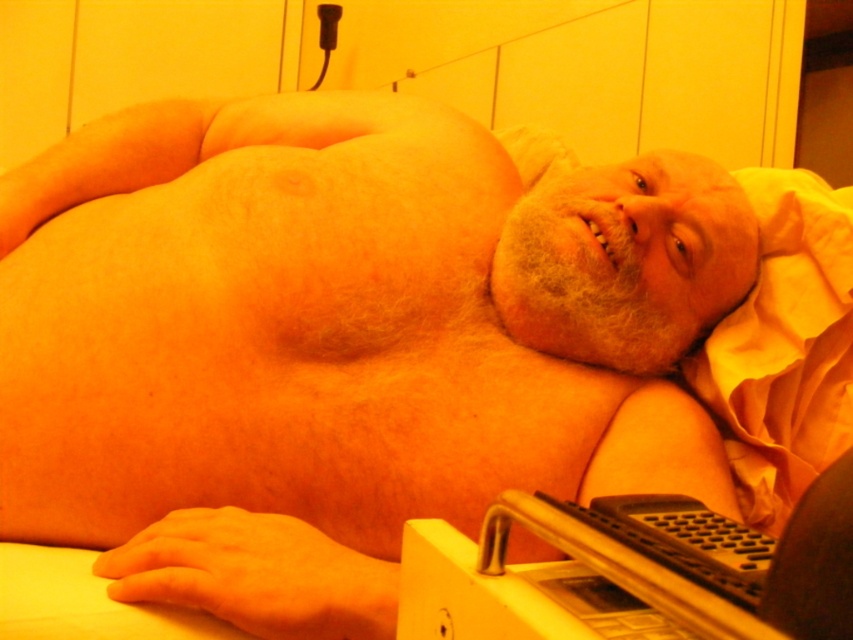
You are a technician in a medical facility. You need to place a 12 inch long medical tool on the nearest flat surface. The black plastic laptop at lower right is present. Can you place the tool on it?

The black plastic laptop at lower right is 11.51 inches from the viewer, which is shorter than the 12 inch medical tool. Therefore, the tool cannot be placed on the black plastic laptop at lower right as it may not fit properly.

Based on the photo, you are a nurse in the room and need to retrieve both the black plastic laptop at lower right and the yellow fabric pillow at right. Which object should you reach for first to minimize the distance traveled?

The black plastic laptop at lower right is closer to the viewer than the yellow fabric pillow at right, so you should reach for the black plastic laptop at lower right first to minimize the distance traveled.

You are a nurse in a clinic and need to place a new monitor between the black plastic laptop at lower right and the yellow fabric pillow at right. Based on their current positions, which object should the monitor be placed to the left of?

The black plastic laptop at lower right is positioned on the left side of yellow fabric pillow at right. Therefore, the monitor should be placed to the left of the yellow fabric pillow at right.